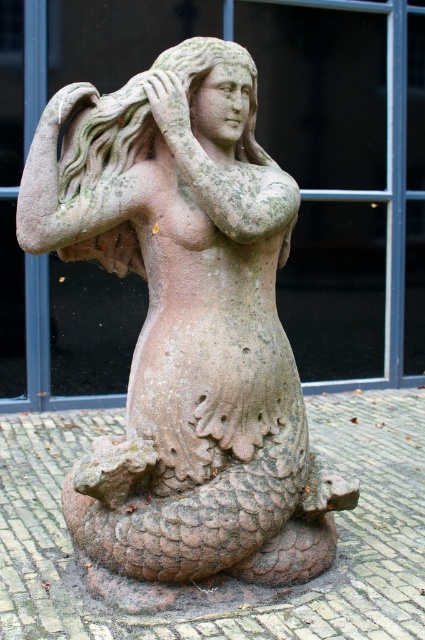
Question: Which object appears farthest from the camera in this image?

Choices:
 (A) green stone head at center
 (B) green mossy stone mermaid at center
 (C) matte stone hand at upper center

Answer: (A)

Question: Is green mossy stone mermaid at center behind matte stone hand at upper center?

Choices:
 (A) yes
 (B) no

Answer: (B)

Question: Which point is closer to the camera?

Choices:
 (A) (251, 97)
 (B) (159, 72)
 (C) (249, 572)

Answer: (B)

Question: Does green mossy stone mermaid at center have a larger size compared to matte stone hand at upper center?

Choices:
 (A) no
 (B) yes

Answer: (B)

Question: Estimate the real-world distances between objects in this image. Which object is farther from the green mossy stone mermaid at center?

Choices:
 (A) matte stone hand at upper center
 (B) green stone head at center

Answer: (B)

Question: Does green mossy stone mermaid at center have a lesser width compared to green stone head at center?

Choices:
 (A) yes
 (B) no

Answer: (B)